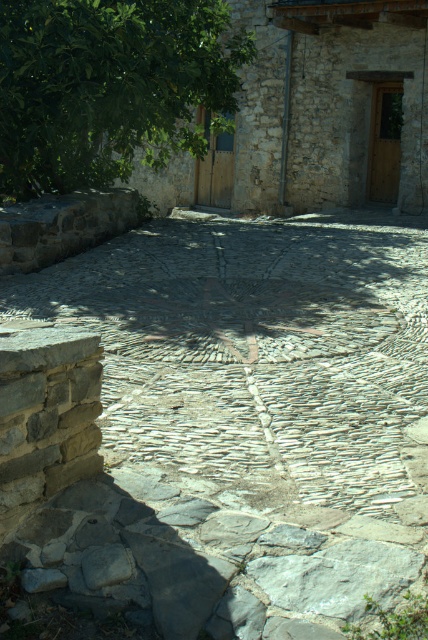
Question: Which object is closer to the camera taking this photo?

Choices:
 (A) natural stone path at center
 (B) green leafy tree at upper left

Answer: (A)

Question: Considering the relative positions of natural stone path at center and green leafy tree at upper left in the image provided, where is natural stone path at center located with respect to green leafy tree at upper left?

Choices:
 (A) above
 (B) below

Answer: (B)

Question: Does natural stone path at center have a lesser width compared to green leafy tree at upper left?

Choices:
 (A) no
 (B) yes

Answer: (A)

Question: Can you confirm if natural stone path at center is wider than green leafy tree at upper left?

Choices:
 (A) no
 (B) yes

Answer: (B)

Question: Which point is closer to the camera?

Choices:
 (A) (196, 3)
 (B) (130, 412)

Answer: (B)